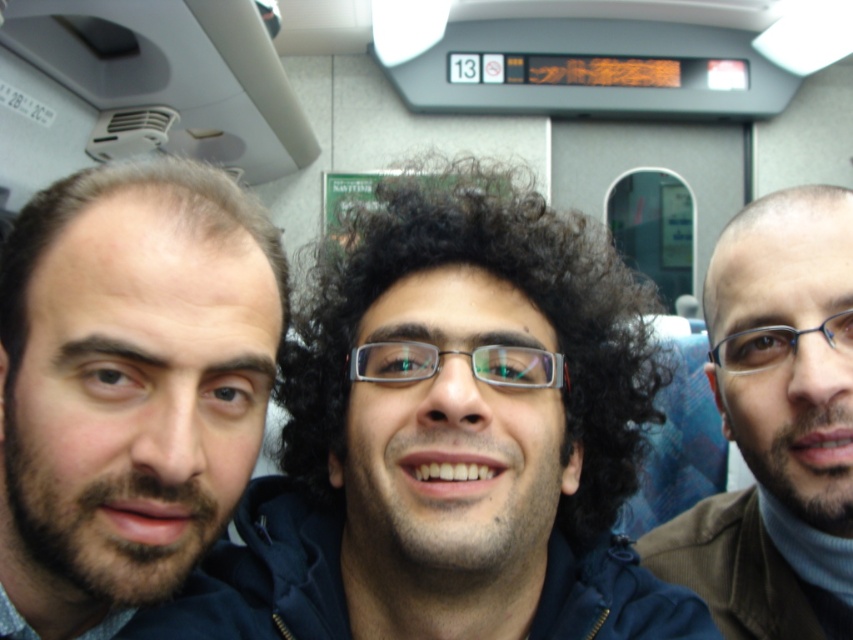
You are a photographer standing in the train carriage. You want to take a photo of the dark blue jacket at center and the brown woolen sweater at right. The minimum distance between the two items for your camera to focus properly is 10 inches. Can you take the photo without moving either item?

The dark blue jacket at center is only 8.80 inches from the brown woolen sweater at right, which is less than the required 10 inches for proper focus. Therefore, you cannot take the photo without moving either item.

You are a tailor who needs to determine which clothing item requires a longer hem. Based on the scene, which item between the dark blue jacket at center and the brown woolen sweater at right should you adjust?

The brown woolen sweater at right requires a longer hem since it is taller than the dark blue jacket at center.

You are a photographer trying to capture a group photo of the bearded man at left and the brown woolen sweater at right. Since you want to include both subjects in the frame, which subject should you focus on to ensure both are visible?

The bearded man at left occupies less space than the brown woolen sweater at right, so focusing on the brown woolen sweater at right would allow both subjects to fit into the frame more easily.